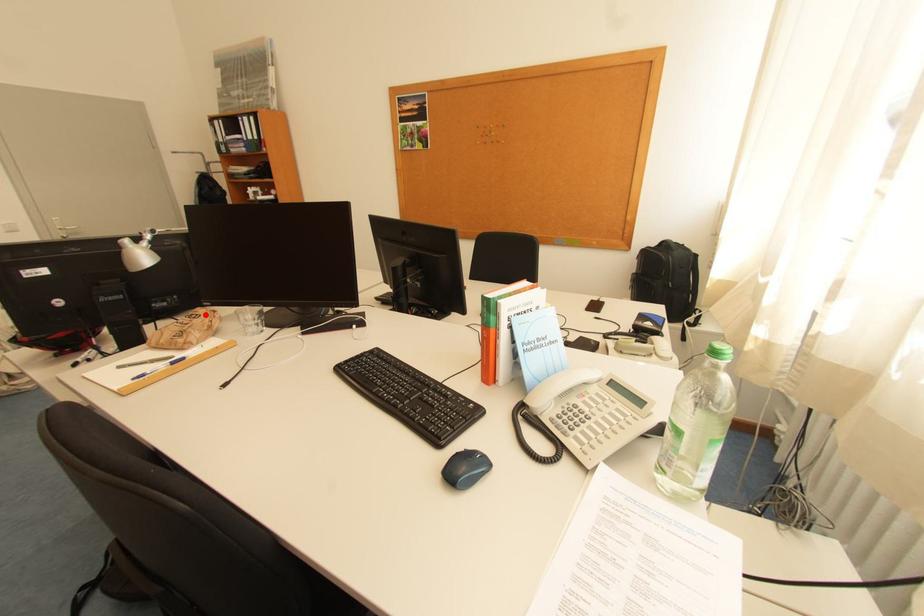
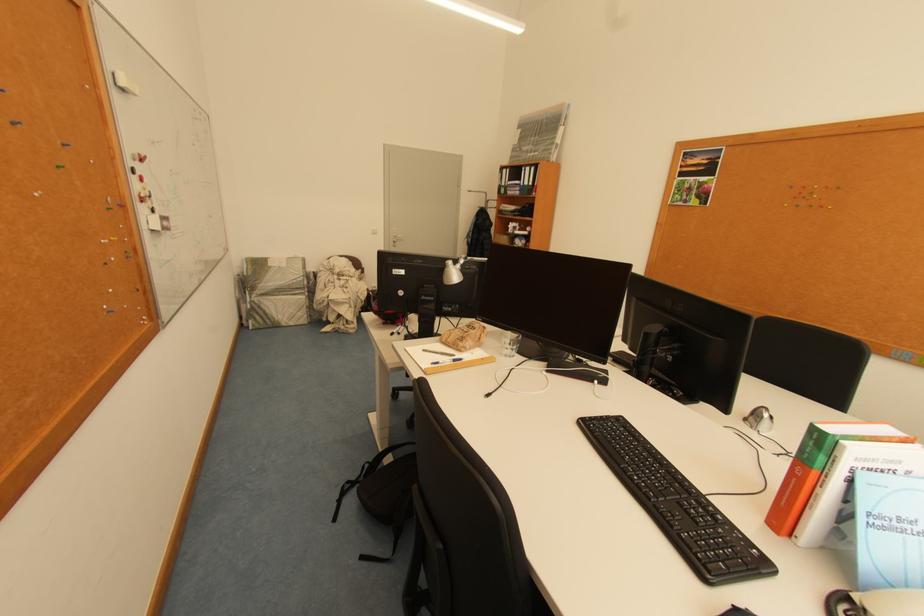
Locate, in the second image, the point that corresponds to the highlighted location in the first image.

(481, 328)